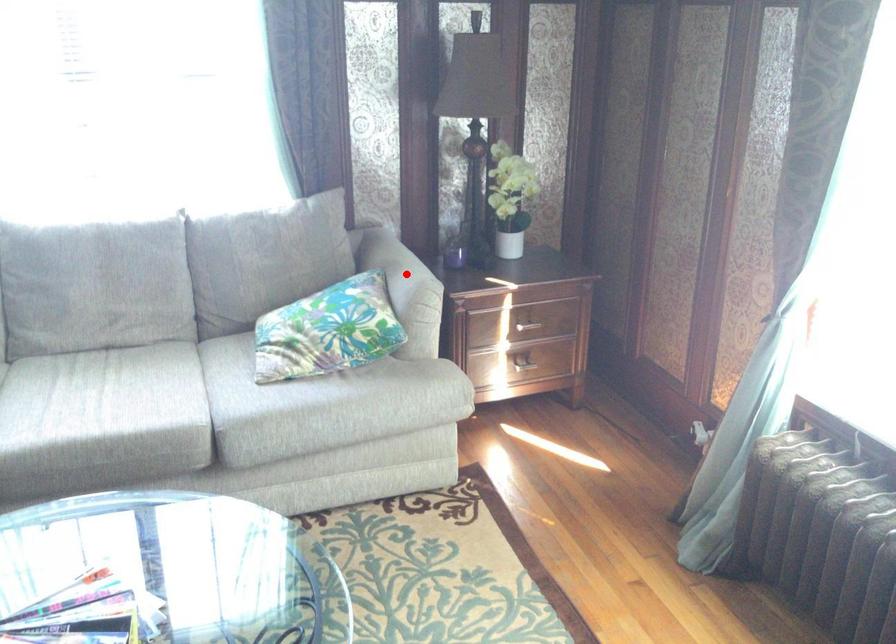
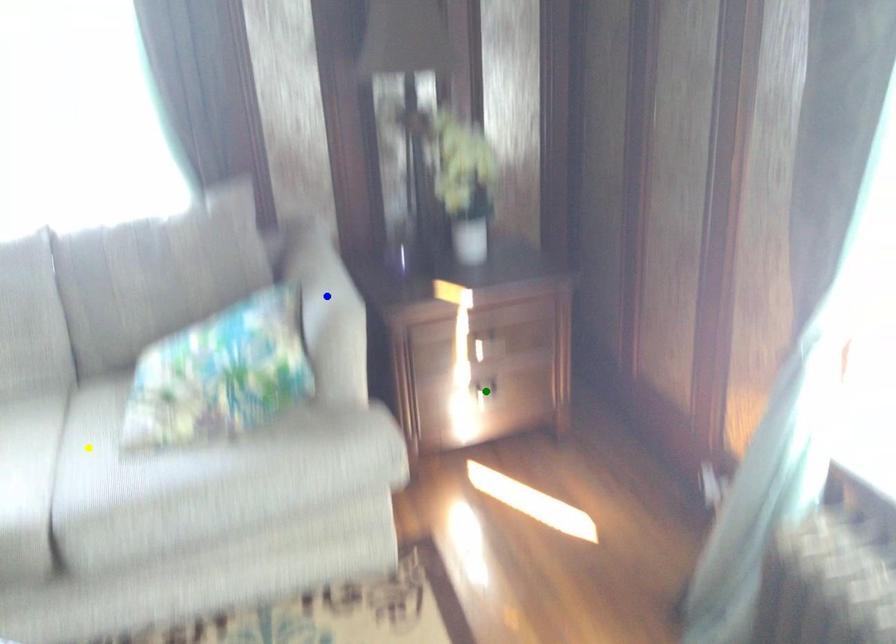
Question: I am providing you with two images of the same scene from different viewpoints. A red point is marked on the first image. You are given multiple points on the second image. Which mark in image 2 goes with the point in image 1?

Choices:
 (A) green point
 (B) yellow point
 (C) blue point

Answer: (C)